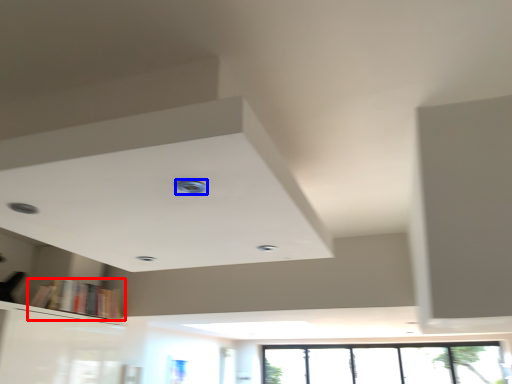
Question: Which object appears farthest to the camera in this image, book (highlighted by a red box) or hole (highlighted by a blue box)?

Choices:
 (A) book
 (B) hole

Answer: (A)